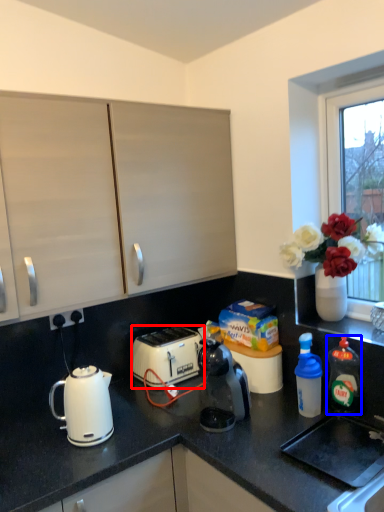
Question: Which of the following is the farthest to the observer, toaster (highlighted by a red box) or bottle (highlighted by a blue box)?

Choices:
 (A) toaster
 (B) bottle

Answer: (A)